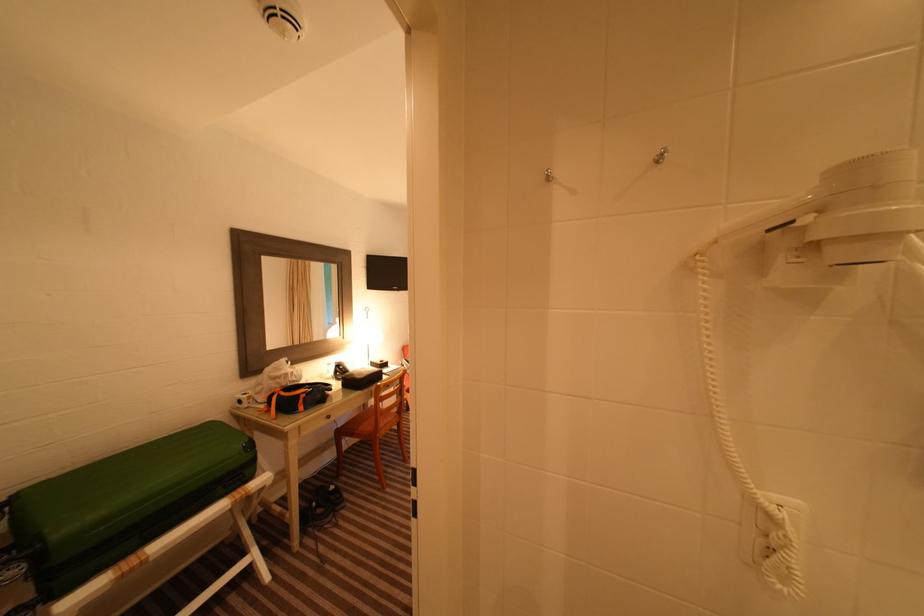
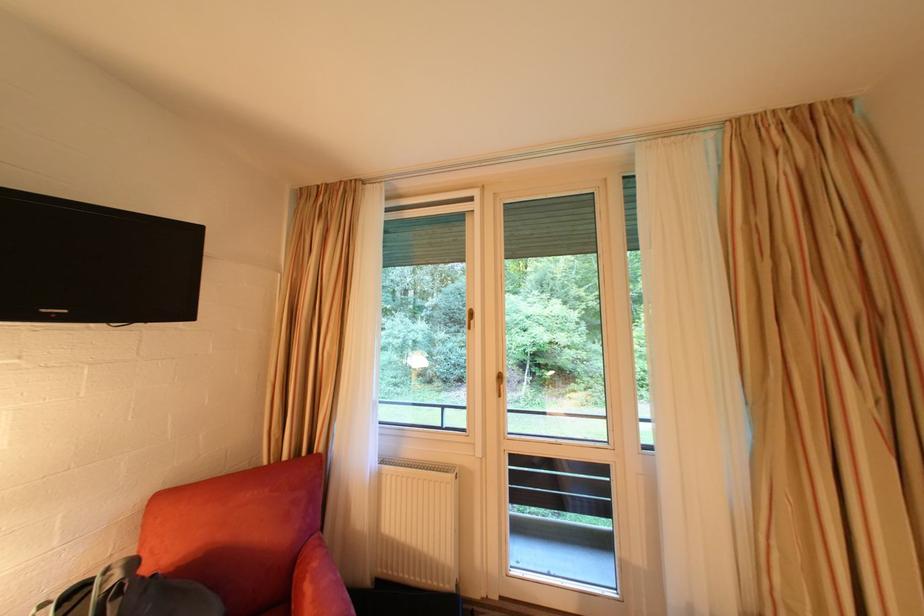
Question: The images are taken continuously from a first-person perspective. In which direction are you moving?

Choices:
 (A) Left
 (B) Right
 (C) Forward
 (D) Backward

Answer: (C)